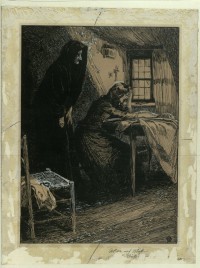
You are a GUI agent. You are given a task and a screenshot of the screen. Output one action in this format:
    pyautogui.click(x=<x>, y=<y>)
    Task: Click on the chair
    This screenshot has width=200, height=268.
    Given the screenshot: What is the action you would take?
    (57, 182)